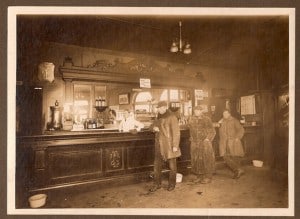
Locate an element on the screen. mirror is located at coordinates click(103, 91), click(44, 72).